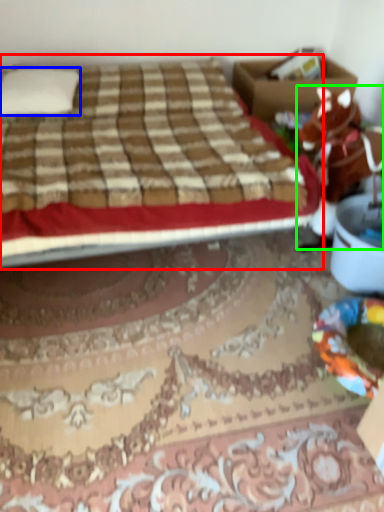
Question: Which is farther away from bed (highlighted by a red box)? pillow (highlighted by a blue box) or animal (highlighted by a green box)?

Choices:
 (A) pillow
 (B) animal

Answer: (B)